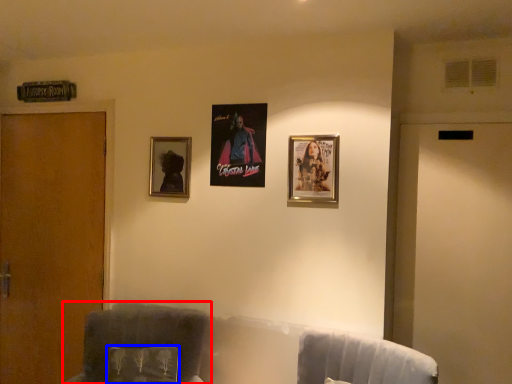
Question: Which object is further to the camera taking this photo, furniture (highlighted by a red box) or pillow (highlighted by a blue box)?

Choices:
 (A) furniture
 (B) pillow

Answer: (B)